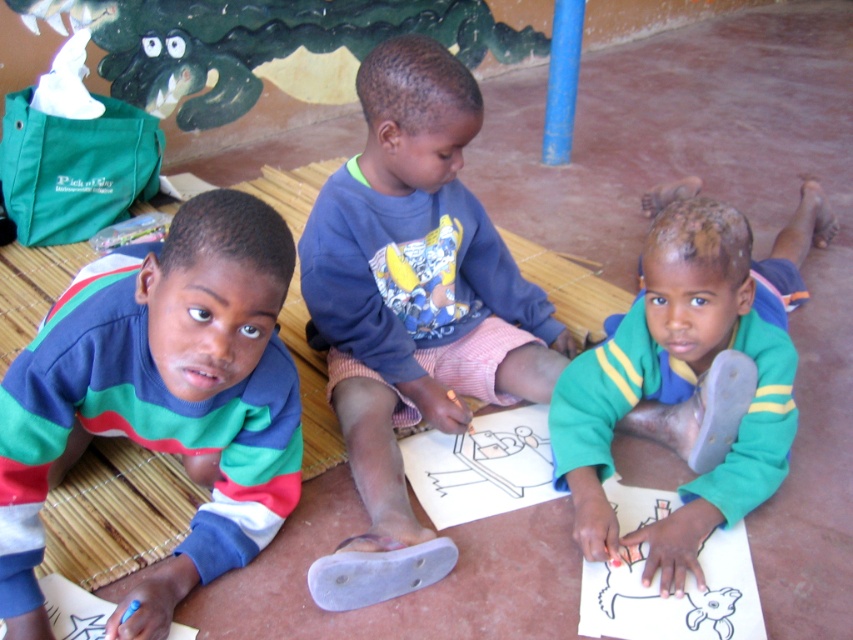
Question: Can you confirm if multicolored striped sweater at left is smaller than blue cotton shirt at center?

Choices:
 (A) no
 (B) yes

Answer: (B)

Question: Which of the following is the closest to the observer?

Choices:
 (A) (575, 531)
 (B) (519, 362)
 (C) (22, 550)

Answer: (C)

Question: Can you confirm if multicolored striped sweater at left is positioned below blue cotton shirt at center?

Choices:
 (A) yes
 (B) no

Answer: (A)

Question: Is multicolored striped sweater at left further to camera compared to green fleece jacket at lower right?

Choices:
 (A) yes
 (B) no

Answer: (B)

Question: Which of the following is the closest to the observer?

Choices:
 (A) (276, 506)
 (B) (682, 268)
 (C) (543, 314)

Answer: (B)

Question: Which point is closer to the camera?

Choices:
 (A) green fleece jacket at lower right
 (B) multicolored striped sweater at left
 (C) blue cotton shirt at center

Answer: (B)